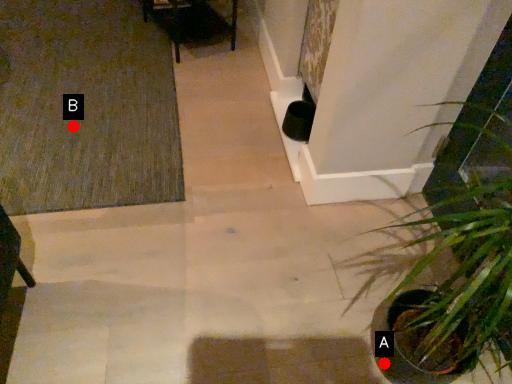
Question: Two points are circled on the image, labeled by A and B beside each circle. Which point is closer to the camera?

Choices:
 (A) A is closer
 (B) B is closer

Answer: (A)